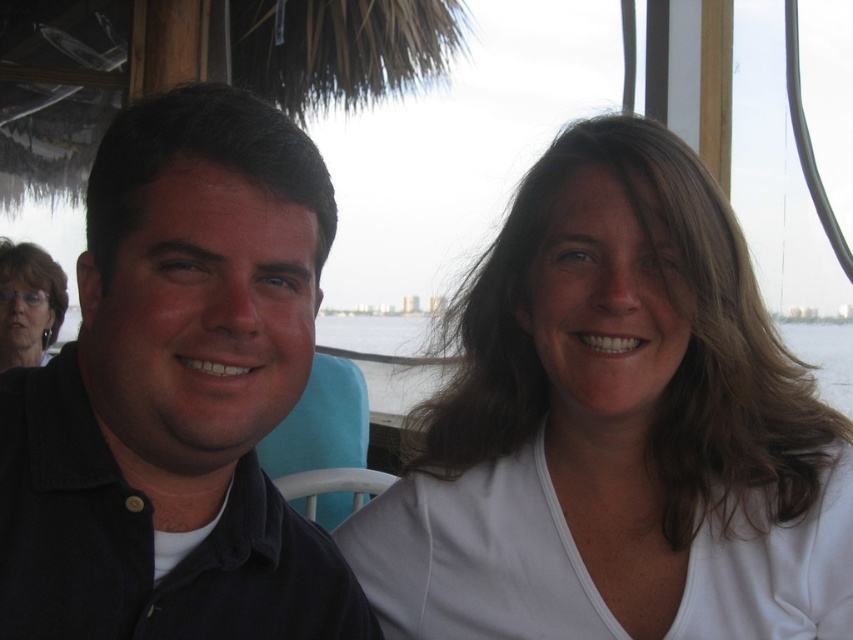
Does point (318, 346) come behind point (54, 308)?

Yes, it is behind point (54, 308).

What do you see at coordinates (384, 356) in the screenshot? Image resolution: width=853 pixels, height=640 pixels. I see `clear water at upper center` at bounding box center [384, 356].

Between point (425, 396) and point (3, 353), which one is positioned behind?

Point (425, 396)

Where is `clear water at upper center`? This screenshot has height=640, width=853. clear water at upper center is located at coordinates (384, 356).

Who is taller, white matte shirt at center or black matte shirt at left?

white matte shirt at center is taller.

Based on the photo, is white matte shirt at center taller than black matte shirt at left?

Indeed, white matte shirt at center has a greater height compared to black matte shirt at left.

In order to click on white matte shirt at center in this screenshot , I will do `click(614, 428)`.

Is black matte shirt at left thinner than clear water at upper center?

Yes, black matte shirt at left is thinner than clear water at upper center.

The height and width of the screenshot is (640, 853). What are the coordinates of `black matte shirt at left` in the screenshot? It's located at (177, 394).